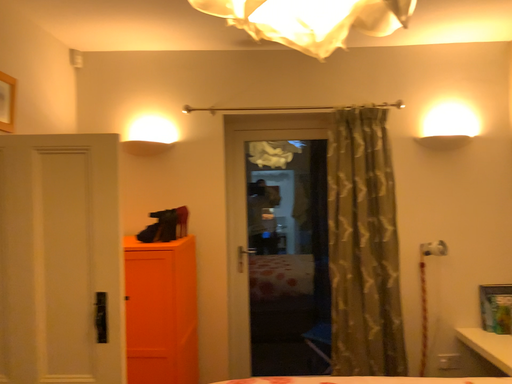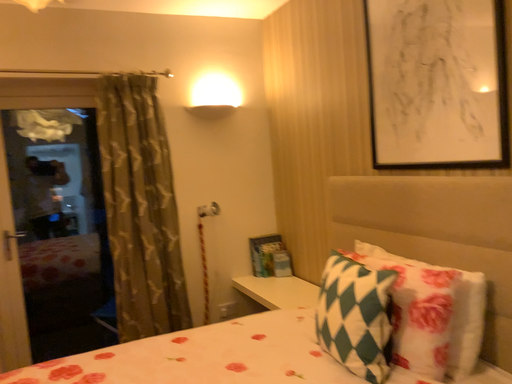
Question: Which way did the camera rotate in the video?

Choices:
 (A) rotated right
 (B) rotated left

Answer: (A)